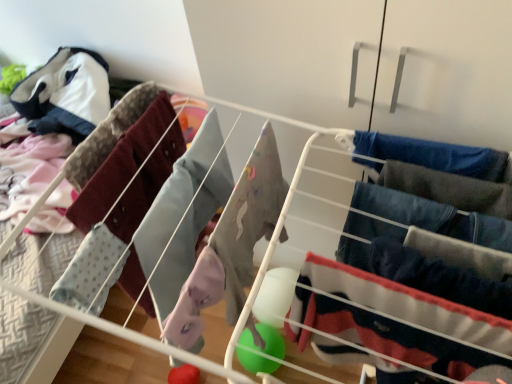
Question: Can you confirm if light blue fabric at left, which ranks as the 4th clothing in right-to-left order, is bigger than denim jeans at right, which is the 3th clothing from left to right?

Choices:
 (A) yes
 (B) no

Answer: (A)

Question: Is light blue fabric at left, which ranks as the 1th clothing in left-to-right order, shorter than denim jeans at right, acting as the 2th clothing starting from the right?

Choices:
 (A) no
 (B) yes

Answer: (A)

Question: Is light blue fabric at left, which ranks as the 1th clothing in left-to-right order, oriented towards denim jeans at right, which is the 3th clothing from left to right?

Choices:
 (A) yes
 (B) no

Answer: (B)

Question: Can you confirm if light blue fabric at left, which ranks as the 1th clothing in left-to-right order, is smaller than denim jeans at right, acting as the 2th clothing starting from the right?

Choices:
 (A) no
 (B) yes

Answer: (A)

Question: Is point (493, 301) closer or farther from the camera than point (88, 182)?

Choices:
 (A) closer
 (B) farther

Answer: (A)

Question: Would you say dark blue fabric pants at right, which ranks as the 1th clothing in right-to-left order, is to the left or to the right of light blue fabric at left, which ranks as the 1th clothing in left-to-right order, in the picture?

Choices:
 (A) right
 (B) left

Answer: (A)

Question: From a real-world perspective, is dark blue fabric pants at right, which ranks as the 1th clothing in right-to-left order, physically located above or below light blue fabric at left, which ranks as the 1th clothing in left-to-right order?

Choices:
 (A) below
 (B) above

Answer: (B)

Question: Looking at their shapes, would you say dark blue fabric pants at right, the fourth clothing positioned from the left, is wider or thinner than light blue fabric at left, which ranks as the 4th clothing in right-to-left order?

Choices:
 (A) thin
 (B) wide

Answer: (A)

Question: Looking at the image, does light blue fabric at left, which ranks as the 4th clothing in right-to-left order, seem bigger or smaller compared to dark blue fabric pants at right, which ranks as the 1th clothing in right-to-left order?

Choices:
 (A) big
 (B) small

Answer: (A)

Question: From a real-world perspective, is light blue fabric at left, which ranks as the 1th clothing in left-to-right order, positioned above or below dark blue fabric pants at right, which ranks as the 1th clothing in right-to-left order?

Choices:
 (A) above
 (B) below

Answer: (B)

Question: In the image, is light blue fabric at left, which ranks as the 1th clothing in left-to-right order, positioned in front of or behind dark blue fabric pants at right, the fourth clothing positioned from the left?

Choices:
 (A) front
 (B) behind

Answer: (B)

Question: Visually, is light blue fabric at left, which ranks as the 4th clothing in right-to-left order, positioned to the left or to the right of dark blue fabric pants at right, which ranks as the 1th clothing in right-to-left order?

Choices:
 (A) right
 (B) left

Answer: (B)

Question: Considering their positions, is velvet navy pants at center right, placed as the 2th clothing when sorted from left to right, located in front of or behind light blue fabric at left, which ranks as the 1th clothing in left-to-right order?

Choices:
 (A) front
 (B) behind

Answer: (A)

Question: In terms of height, does velvet navy pants at center right, placed as the 2th clothing when sorted from left to right, look taller or shorter compared to light blue fabric at left, which ranks as the 1th clothing in left-to-right order?

Choices:
 (A) short
 (B) tall

Answer: (B)